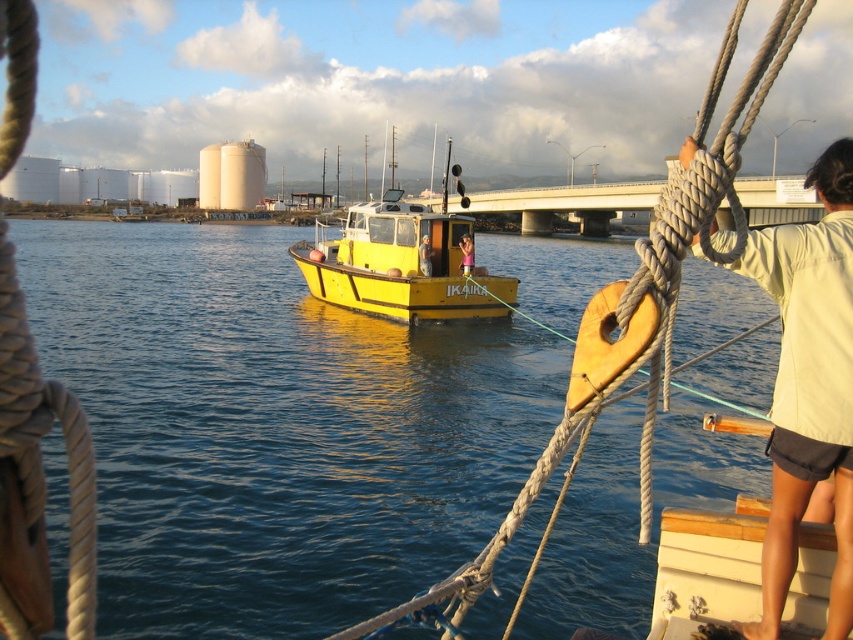
You are a sailor navigating a boat and see the shiny blue water at center and the pink fabric at center. Which object is positioned to the left when facing the direction of the boat?

The shiny blue water at center is to the left of the pink fabric at center when facing the direction of the boat.

You are a passenger on the yellow matte boat at center. You want to jump into the water. Is the shiny blue water at center accessible from your current position?

The shiny blue water at center is positioned under the yellow matte boat at center, so yes, the passenger can jump into the shiny blue water at center from their current position.

You are standing on the deck of the IKAIKA boat and want to reach a specific point marked at coordinates point (73, 387). If you can throw an object 15 meters, will you be able to reach that point?

The distance of point (73, 387) from viewer is 13.47 meters, so yes, you can reach the point since 13.47 meters is within your throwing range of 15 meters.